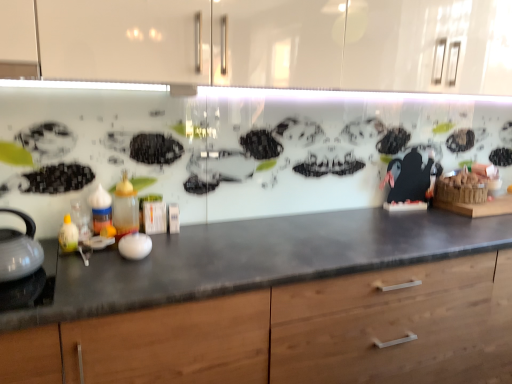
Image resolution: width=512 pixels, height=384 pixels. Identify the location of vacant area that is situated to the right of white glossy tea pot at left. (82, 272).